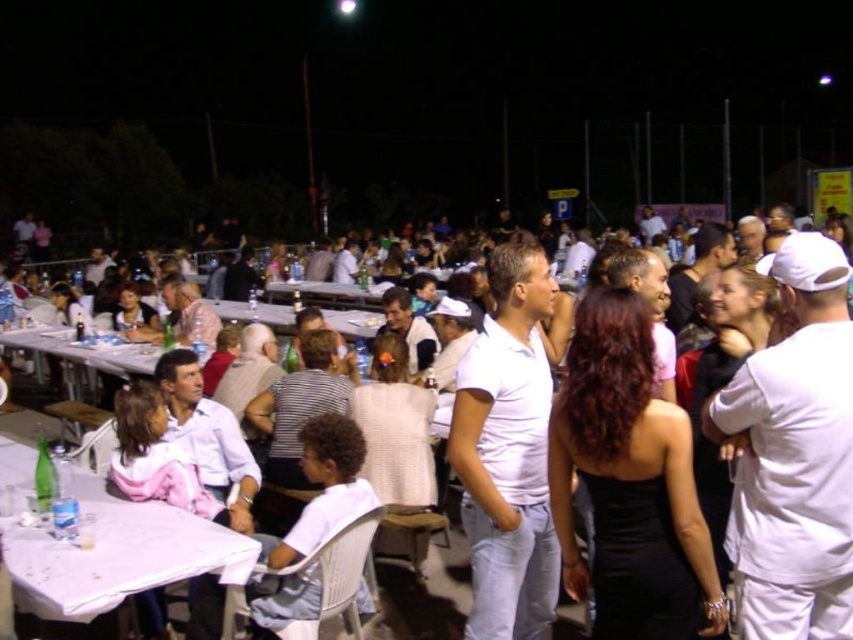
Question: Is white plastic table at lower left above white cotton shirt at center?

Choices:
 (A) yes
 (B) no

Answer: (A)

Question: Which object is closer to the camera taking this photo?

Choices:
 (A) white cotton shirt at center
 (B) white plastic table at left
 (C) white plastic table at lower left

Answer: (C)

Question: Where is white cotton shirt at center located in relation to white plastic table at left in the image?

Choices:
 (A) below
 (B) above

Answer: (A)

Question: Does white cotton shirt at center lie in front of white plastic table at left?

Choices:
 (A) yes
 (B) no

Answer: (A)

Question: Based on their relative distances, which object is nearer to the white cotton shirt at center?

Choices:
 (A) white plastic table at left
 (B) white plastic table at lower left

Answer: (B)

Question: Which object is the closest to the white plastic table at lower left?

Choices:
 (A) white cotton shirt at center
 (B) white plastic table at left

Answer: (A)